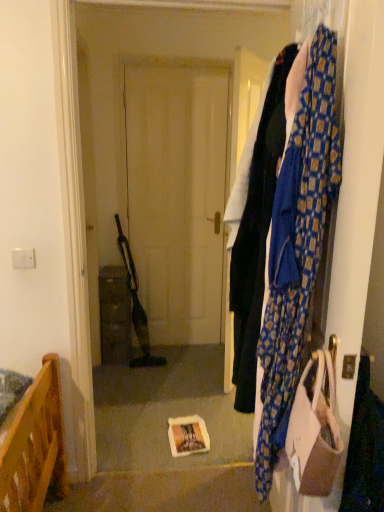
Question: Considering the relative positions of blue patterned scarf at right and brown matte cabinet at center in the image provided, is blue patterned scarf at right to the left of brown matte cabinet at center from the viewer's perspective?

Choices:
 (A) yes
 (B) no

Answer: (B)

Question: Does blue patterned scarf at right come behind brown matte cabinet at center?

Choices:
 (A) no
 (B) yes

Answer: (A)

Question: Considering the relative sizes of blue patterned scarf at right and brown matte cabinet at center in the image provided, is blue patterned scarf at right bigger than brown matte cabinet at center?

Choices:
 (A) no
 (B) yes

Answer: (A)

Question: From a real-world perspective, is blue patterned scarf at right beneath brown matte cabinet at center?

Choices:
 (A) yes
 (B) no

Answer: (B)

Question: Considering the relative positions of blue patterned scarf at right and brown matte cabinet at center in the image provided, is blue patterned scarf at right to the right of brown matte cabinet at center from the viewer's perspective?

Choices:
 (A) no
 (B) yes

Answer: (B)

Question: In terms of height, does blue patterned fabric at right look taller or shorter compared to beige fabric handbag at right?

Choices:
 (A) short
 (B) tall

Answer: (B)

Question: Considering the positions of point (251, 296) and point (312, 487), is point (251, 296) closer or farther from the camera than point (312, 487)?

Choices:
 (A) farther
 (B) closer

Answer: (A)

Question: From a real-world perspective, is blue patterned fabric at right above or below beige fabric handbag at right?

Choices:
 (A) above
 (B) below

Answer: (A)

Question: Considering the positions of blue patterned fabric at right and beige fabric handbag at right in the image, is blue patterned fabric at right bigger or smaller than beige fabric handbag at right?

Choices:
 (A) small
 (B) big

Answer: (B)

Question: Based on their sizes in the image, would you say blue patterned scarf at right is bigger or smaller than beige fabric handbag at right?

Choices:
 (A) small
 (B) big

Answer: (B)

Question: Is blue patterned scarf at right inside the boundaries of beige fabric handbag at right, or outside?

Choices:
 (A) outside
 (B) inside

Answer: (A)

Question: From a real-world perspective, is blue patterned scarf at right positioned above or below beige fabric handbag at right?

Choices:
 (A) above
 (B) below

Answer: (A)

Question: Considering the positions of point (301, 330) and point (312, 407), is point (301, 330) closer or farther from the camera than point (312, 407)?

Choices:
 (A) farther
 (B) closer

Answer: (A)

Question: In terms of height, does brown matte cabinet at center look taller or shorter compared to beige fabric handbag at right?

Choices:
 (A) short
 (B) tall

Answer: (B)

Question: Looking at their shapes, would you say brown matte cabinet at center is wider or thinner than beige fabric handbag at right?

Choices:
 (A) wide
 (B) thin

Answer: (A)